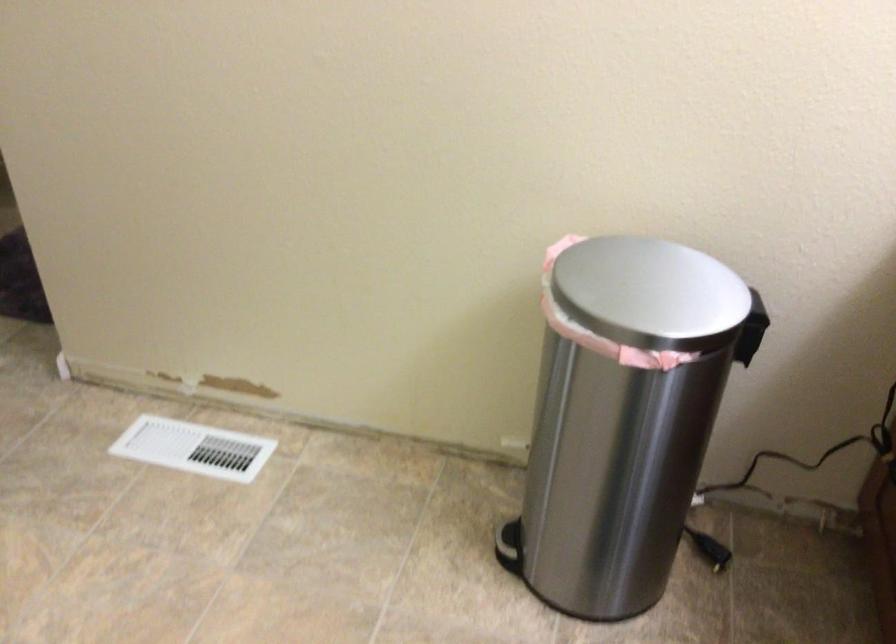
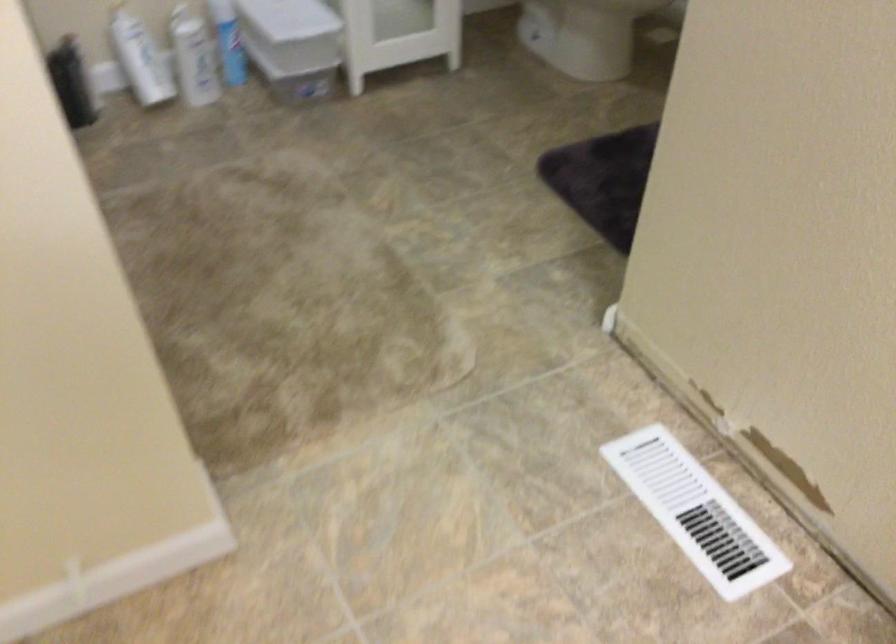
Where in the second image is the point corresponding to point (204, 447) from the first image?

(695, 512)